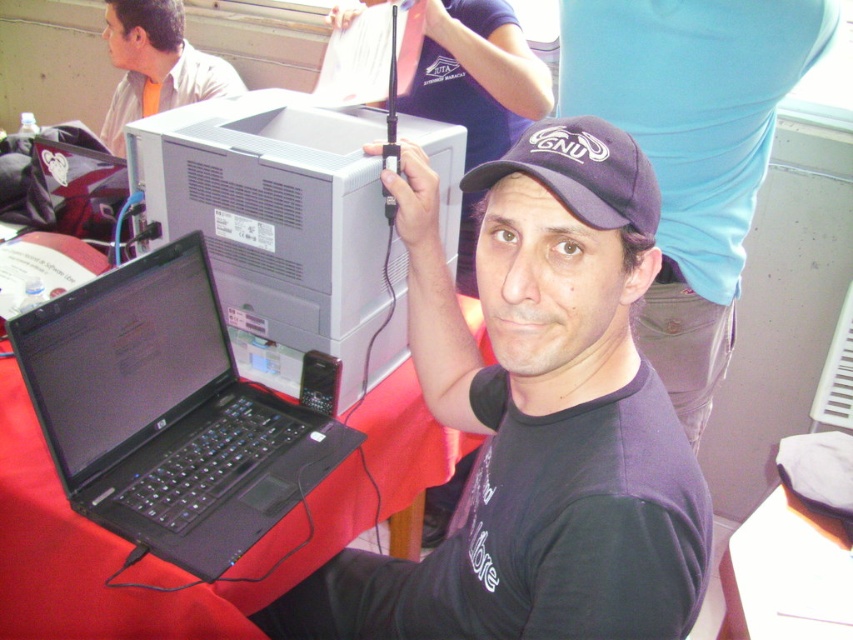
You are a photographer standing 5 feet away from the table. You want to take a photo of the black matte laptop at lower left and the dark blue fabric baseball cap at center without any obstruction. Can you fit both objects in the frame if your camera has a 60 cm wide field of view?

The black matte laptop at lower left and dark blue fabric baseball cap at center are 23.10 inches apart. Converting 23.10 inches to centimeters gives approximately 58.65 cm. Since the camera has a 60 cm wide field of view, both objects can fit within the frame without obstruction.

You are standing in front of the table where the man is sitting. The point at coordinates point (619,148) is located on the table. If you want to place a 12 inch ruler from your current position to that point, will it reach?

The point at coordinates point (619,148) is 28.51 inches away from you. Since the ruler is only 12 inches long, it will not reach that point.